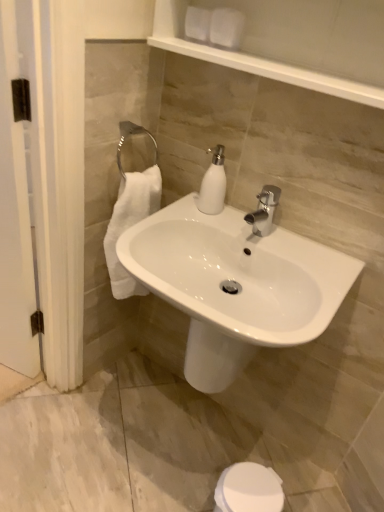
Question: From the image's perspective, is white wood screen door at left positioned above or below white matte toilet paper at upper center?

Choices:
 (A) below
 (B) above

Answer: (A)

Question: From a real-world perspective, is white wood screen door at left physically located above or below white matte toilet paper at upper center?

Choices:
 (A) below
 (B) above

Answer: (A)

Question: Estimate the real-world distances between objects in this image. Which object is farther from the white glossy soap dispenser at center?

Choices:
 (A) white wood screen door at left
 (B) white matte toilet paper at upper center
 (C) white glossy sink at center

Answer: (A)

Question: Which object is positioned closest to the white wood screen door at left?

Choices:
 (A) white glossy soap dispenser at center
 (B) white glossy sink at center
 (C) white matte toilet paper at upper center

Answer: (A)